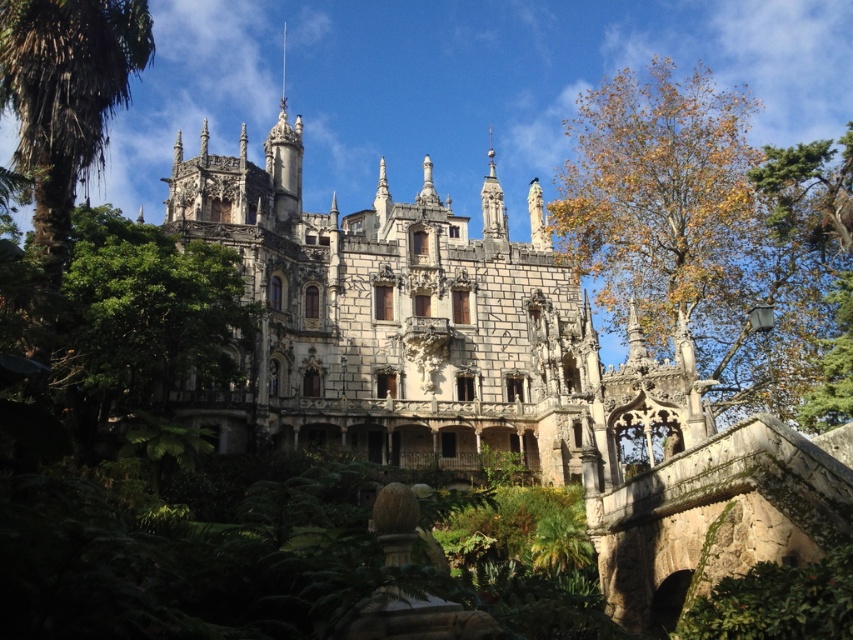
You are standing in front of the stone castle at center and want to take a photo of it. However, there is a green leafy palm at upper left in the way. Based on their sizes, will the palm block the view of the castle?

The stone castle at center is taller than the green leafy palm at upper left, so the palm will not block the view of the castle.

You are an architect evaluating the proportions of the stone castle at center and the green leafy palm at upper left in the image. Which object occupies more visual space in the composition?

The stone castle at center is bigger than the green leafy palm at upper left, so it occupies more visual space in the composition.